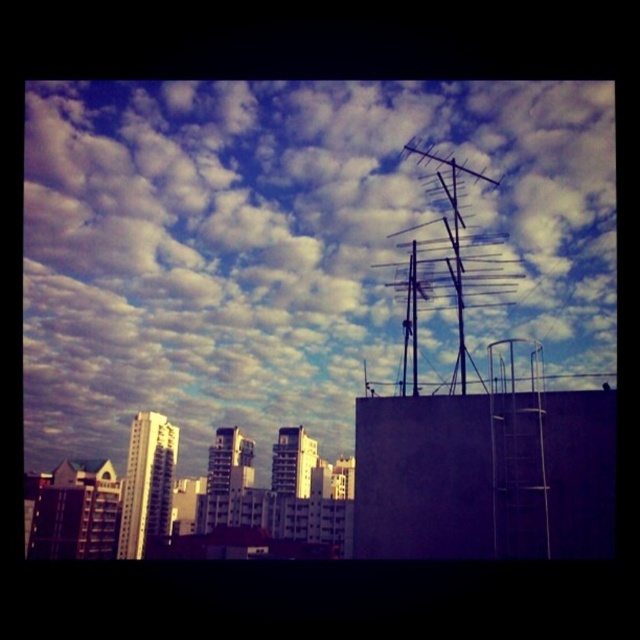
Looking at this image, does cloudy sky at upper center come behind metallic antenna at upper right?

Yes, cloudy sky at upper center is further from the viewer.

Between cloudy sky at upper center and metallic antenna at upper right, which one has more height?

Standing taller between the two is cloudy sky at upper center.

Between point (520, 202) and point (484, 177), which one is positioned in front?

Point (484, 177)

Image resolution: width=640 pixels, height=640 pixels. Identify the location of cloudy sky at upper center. (284, 244).